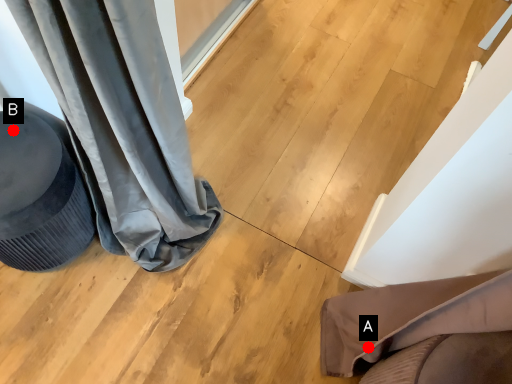
Question: Two points are circled on the image, labeled by A and B beside each circle. Which point is further to the camera?

Choices:
 (A) A is further
 (B) B is further

Answer: (A)